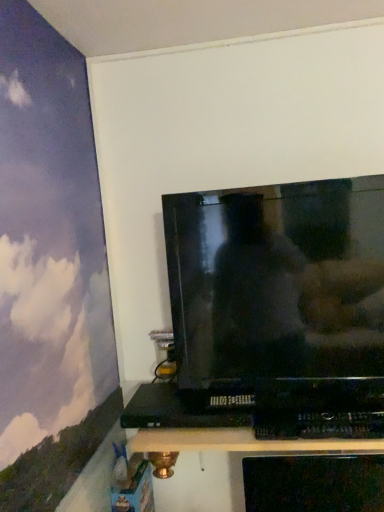
Question: In the image, is glossy black tv at upper center positioned in front of or behind black plastic dvd player at lower center?

Choices:
 (A) front
 (B) behind

Answer: (A)

Question: Based on their positions, is glossy black tv at upper center located to the left or right of black plastic dvd player at lower center?

Choices:
 (A) right
 (B) left

Answer: (A)

Question: Based on their relative distances, which object is farther from the glossy black tv at upper center?

Choices:
 (A) purple matte wall at upper left
 (B) black plastic dvd player at lower center
 (C) black plastic shelf at lower center

Answer: (C)

Question: Which object is positioned closest to the black plastic dvd player at lower center?

Choices:
 (A) glossy black tv at upper center
 (B) black plastic shelf at lower center
 (C) purple matte wall at upper left

Answer: (A)